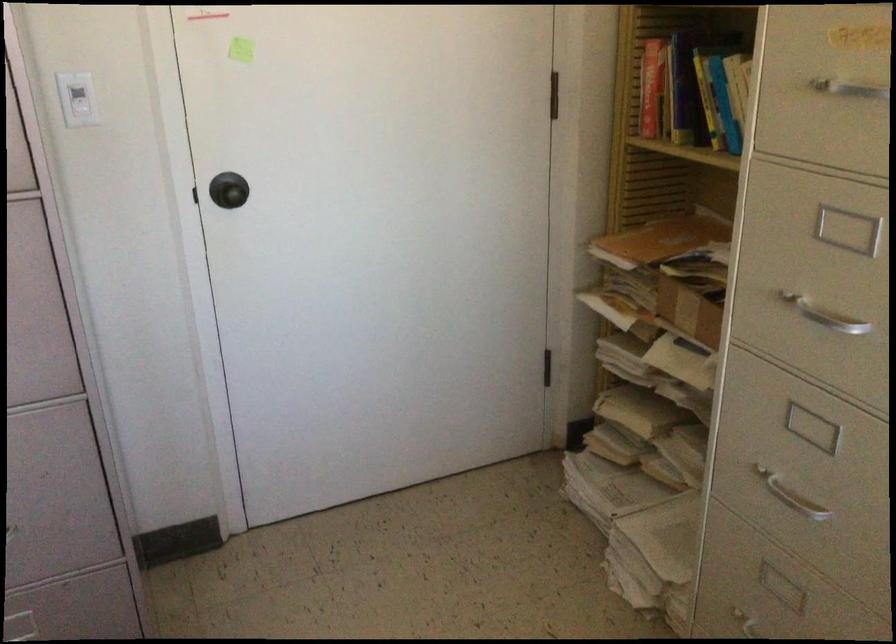
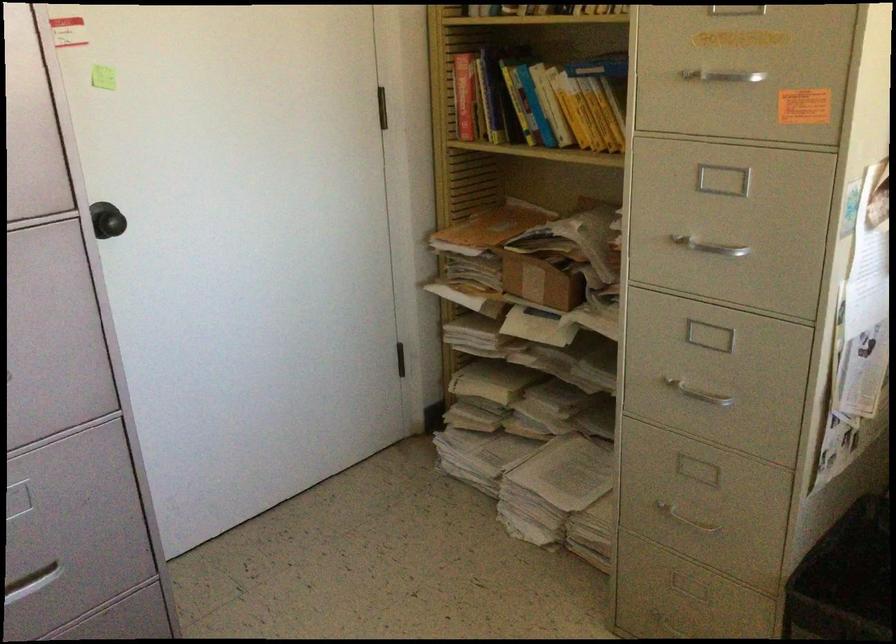
Where in the second image is the point corresponding to pixel 648 86 from the first image?

(464, 96)